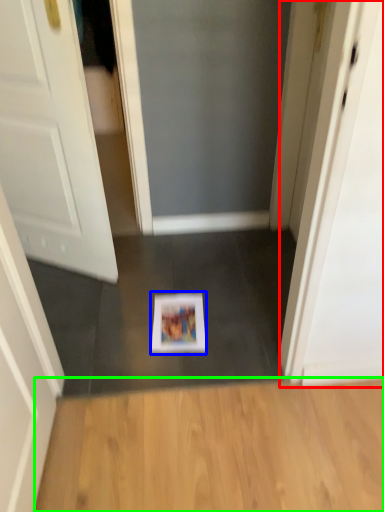
Question: Which is farther away from screen door (highlighted by a red box)? magazine (highlighted by a blue box) or hardwood (highlighted by a green box)?

Choices:
 (A) magazine
 (B) hardwood

Answer: (A)